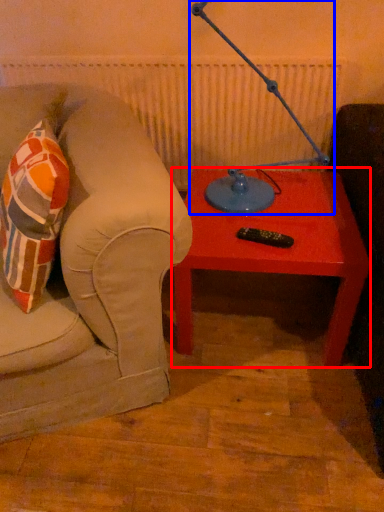
Question: Which object appears closest to the camera in this image, table (highlighted by a red box) or table lamp (highlighted by a blue box)?

Choices:
 (A) table
 (B) table lamp

Answer: (B)